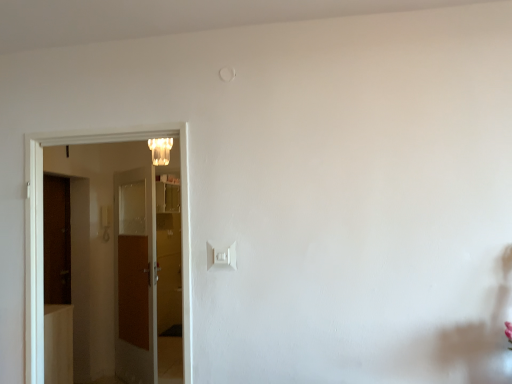
Question: Considering the relative sizes of white plastic light switch at center and brown wooden door at left, the 1th door from the back, in the image provided, is white plastic light switch at center thinner than brown wooden door at left, the 1th door from the back,?

Choices:
 (A) yes
 (B) no

Answer: (A)

Question: Is white plastic light switch at center aimed at brown wooden door at left, which is counted as the 2th door, starting from the front?

Choices:
 (A) yes
 (B) no

Answer: (B)

Question: From the image's perspective, is white plastic light switch at center on brown wooden door at left, the 1th door from the back?

Choices:
 (A) yes
 (B) no

Answer: (A)

Question: Can you confirm if white plastic light switch at center is bigger than brown wooden door at left, the 1th door from the back?

Choices:
 (A) yes
 (B) no

Answer: (B)

Question: Considering the relative sizes of white plastic light switch at center and brown wooden door at left, the 1th door from the back, in the image provided, is white plastic light switch at center smaller than brown wooden door at left, the 1th door from the back,?

Choices:
 (A) no
 (B) yes

Answer: (B)

Question: Is white plastic light switch at center at the left side of brown wooden door at left, which is counted as the 2th door, starting from the front?

Choices:
 (A) no
 (B) yes

Answer: (A)

Question: Is translucent glass chandelier at upper center at the right side of brown wooden door at left, which is counted as the 2th door, starting from the front?

Choices:
 (A) no
 (B) yes

Answer: (B)

Question: Considering the relative sizes of translucent glass chandelier at upper center and brown wooden door at left, the 1th door from the back, in the image provided, is translucent glass chandelier at upper center thinner than brown wooden door at left, the 1th door from the back,?

Choices:
 (A) yes
 (B) no

Answer: (B)

Question: Is translucent glass chandelier at upper center to the left of brown wooden door at left, the 1th door from the back, from the viewer's perspective?

Choices:
 (A) yes
 (B) no

Answer: (B)

Question: Could you tell me if translucent glass chandelier at upper center is turned towards brown wooden door at left, the 1th door from the back?

Choices:
 (A) yes
 (B) no

Answer: (B)

Question: Is translucent glass chandelier at upper center taller than brown wooden door at left, the 1th door from the back?

Choices:
 (A) no
 (B) yes

Answer: (A)

Question: From a real-world perspective, is translucent glass chandelier at upper center located higher than brown wooden door at left, which is counted as the 2th door, starting from the front?

Choices:
 (A) no
 (B) yes

Answer: (B)

Question: Is brown wooden door at left, which is counted as the 2th door, starting from the front, smaller than white plastic light switch at center?

Choices:
 (A) no
 (B) yes

Answer: (A)